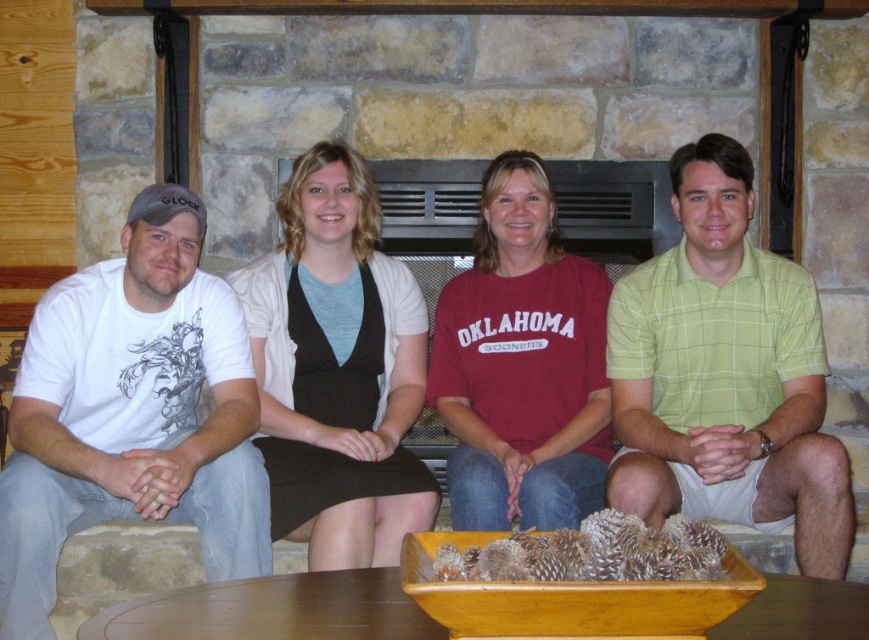
Question: Does black matte dress at center appear on the right side of maroon cotton shirt at center?

Choices:
 (A) no
 (B) yes

Answer: (A)

Question: Which of the following is the farthest from the observer?

Choices:
 (A) (283, 522)
 (B) (492, 461)
 (C) (760, 262)

Answer: (C)

Question: Which point is closer to the camera taking this photo?

Choices:
 (A) (376, 316)
 (B) (672, 368)
 (C) (547, 260)

Answer: (B)

Question: Can you confirm if white matte t-shirt at left is positioned to the left of green plaid shirt at right?

Choices:
 (A) yes
 (B) no

Answer: (A)

Question: Based on their relative distances, which object is farther from the green plaid shirt at right?

Choices:
 (A) black matte dress at center
 (B) maroon cotton shirt at center

Answer: (A)

Question: Can you confirm if white matte t-shirt at left is wider than black matte dress at center?

Choices:
 (A) yes
 (B) no

Answer: (A)